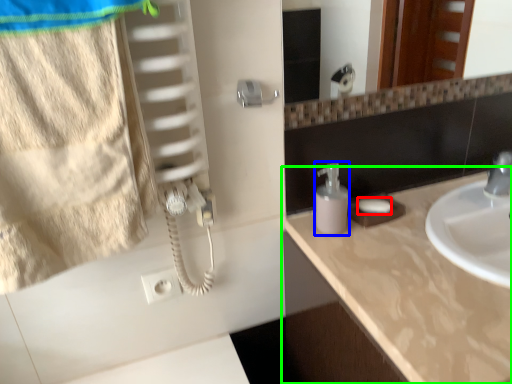
Question: Estimate the real-world distances between objects in this image. Which object is closer to soap (highlighted by a red box), soap dispenser (highlighted by a blue box) or countertop (highlighted by a green box)?

Choices:
 (A) soap dispenser
 (B) countertop

Answer: (A)